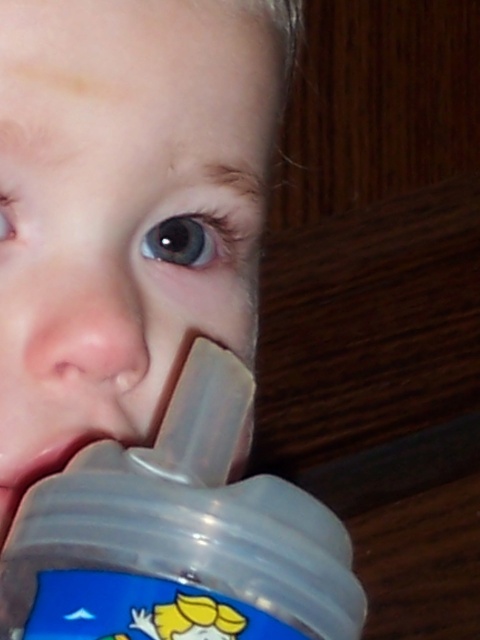
Question: Which point is farther to the camera?

Choices:
 (A) (312, 513)
 (B) (91, 465)
 (C) (245, 192)
 (D) (123, 310)

Answer: (C)

Question: Which point is closer to the camera taking this photo?

Choices:
 (A) (201, 90)
 (B) (82, 444)
 (C) (29, 609)
 (D) (94, 333)

Answer: (C)

Question: Does translucent plastic sippy cup at lower left have a greater width compared to matte plastic nose at center?

Choices:
 (A) no
 (B) yes

Answer: (B)

Question: Can you confirm if matte plastic nose at center is positioned below transparent plastic mouth at lower left?

Choices:
 (A) yes
 (B) no

Answer: (B)

Question: Is matte plastic nose at center closer to camera compared to transparent plastic mouth at lower left?

Choices:
 (A) yes
 (B) no

Answer: (B)

Question: Estimate the real-world distances between objects in this image. Which object is closer to the matte plastic nose at center?

Choices:
 (A) transparent plastic baby bottle at lower center
 (B) translucent plastic sippy cup at lower left

Answer: (B)